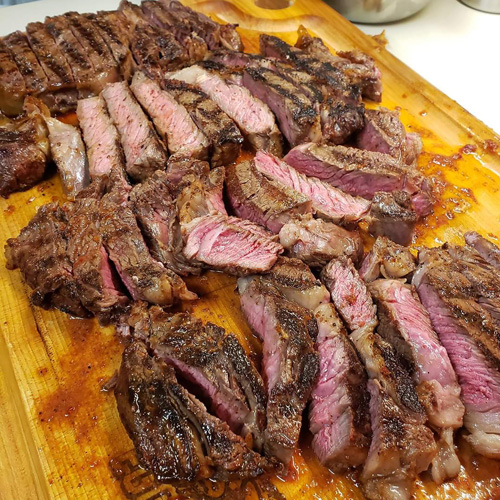
Where is `steel pot`? The image size is (500, 500). steel pot is located at coordinates (377, 18).